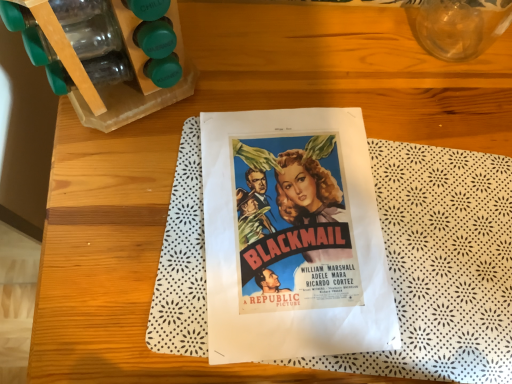
Question: Is transparent glass vase at upper right taller or shorter than vivid paper poster at center?

Choices:
 (A) short
 (B) tall

Answer: (B)

Question: From the image's perspective, relative to vivid paper poster at center, is transparent glass vase at upper right above or below?

Choices:
 (A) below
 (B) above

Answer: (B)

Question: Is transparent glass vase at upper right wider or thinner than vivid paper poster at center?

Choices:
 (A) thin
 (B) wide

Answer: (A)

Question: Considering the positions of vivid paper poster at center and transparent glass vase at upper right in the image, is vivid paper poster at center wider or thinner than transparent glass vase at upper right?

Choices:
 (A) thin
 (B) wide

Answer: (B)

Question: Based on their positions, is vivid paper poster at center located to the left or right of transparent glass vase at upper right?

Choices:
 (A) left
 (B) right

Answer: (A)

Question: Is vivid paper poster at center bigger or smaller than transparent glass vase at upper right?

Choices:
 (A) small
 (B) big

Answer: (A)

Question: From the image's perspective, is vivid paper poster at center located above or below transparent glass vase at upper right?

Choices:
 (A) above
 (B) below

Answer: (B)